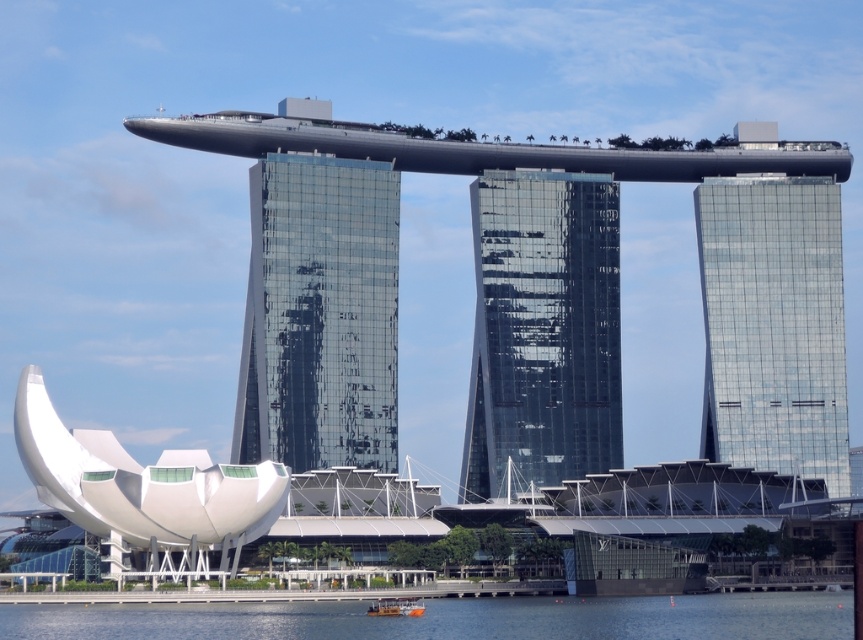
Who is more forward, (x=300, y=272) or (x=410, y=612)?

Point (x=410, y=612) is in front.

Is point (313, 451) less distant than point (420, 611)?

No, it is behind (420, 611).

In order to click on transparent glass building at center in this screenshot , I will do `click(320, 316)`.

Based on the photo, is transparent glass skyscraper at right above clear blue water at lower center?

Yes, transparent glass skyscraper at right is above clear blue water at lower center.

Which of these two, transparent glass skyscraper at right or clear blue water at lower center, stands taller?

Standing taller between the two is transparent glass skyscraper at right.

Between point (780, 260) and point (794, 634), which one is positioned in front?

Point (794, 634) is more forward.

Find the location of a particular element. This screenshot has width=863, height=640. transparent glass skyscraper at right is located at coordinates (773, 324).

Which of these two, transparent glass building at center or transparent glass skyscraper at right, stands shorter?

Standing shorter between the two is transparent glass building at center.

Based on the photo, is the position of transparent glass building at center less distant than that of transparent glass skyscraper at right?

Yes, transparent glass building at center is in front of transparent glass skyscraper at right.

Find the location of a particular element. The height and width of the screenshot is (640, 863). transparent glass building at center is located at coordinates (320, 316).